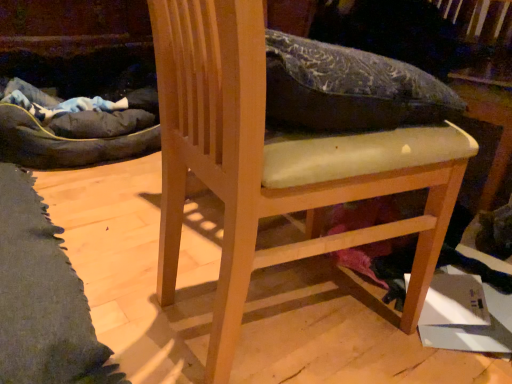
Locate an element on the screen. This screenshot has width=512, height=384. light wood chair at center is located at coordinates (276, 165).

Image resolution: width=512 pixels, height=384 pixels. Describe the element at coordinates (276, 165) in the screenshot. I see `light wood chair at center` at that location.

The height and width of the screenshot is (384, 512). What do you see at coordinates (467, 317) in the screenshot?
I see `white cardboard box at lower right` at bounding box center [467, 317].

Find the location of a particular element. The width and height of the screenshot is (512, 384). white cardboard box at lower right is located at coordinates coord(467,317).

In order to face white cardboard box at lower right, should I rotate leftwards or rightwards?

You should look right and rotate roughly 26.870 degrees.

Image resolution: width=512 pixels, height=384 pixels. In order to click on light wood chair at center in this screenshot , I will do `click(276, 165)`.

Is white cardboard box at lower right to the left of light wood chair at center from the viewer's perspective?

No.

Between white cardboard box at lower right and light wood chair at center, which one is positioned behind?

white cardboard box at lower right.

Does point (445, 304) come closer to viewer compared to point (441, 160)?

No.

From the image's perspective, which one is positioned higher, white cardboard box at lower right or light wood chair at center?

light wood chair at center appears higher in the image.

From a real-world perspective, which is physically below, white cardboard box at lower right or light wood chair at center?

From a 3D spatial view, white cardboard box at lower right is below.

Is white cardboard box at lower right wider than light wood chair at center?

No.

Which of these two, white cardboard box at lower right or light wood chair at center, stands shorter?

With less height is white cardboard box at lower right.

Looking at this image, considering the sizes of objects white cardboard box at lower right and light wood chair at center in the image provided, who is bigger, white cardboard box at lower right or light wood chair at center?

light wood chair at center is bigger.

Is white cardboard box at lower right completely or partially outside of light wood chair at center?

Absolutely, white cardboard box at lower right is external to light wood chair at center.

Is white cardboard box at lower right not close to light wood chair at center?

white cardboard box at lower right is near light wood chair at center, not far away.

Is light wood chair at center at the back of white cardboard box at lower right?

No, white cardboard box at lower right's orientation is not away from light wood chair at center.

Can you tell me how much white cardboard box at lower right and light wood chair at center differ in facing direction?

135 degrees.

Identify the location of furniture above the white cardboard box at lower right (from the image's perspective). (276, 165).

Which object is positioned more to the right, light wood chair at center or white cardboard box at lower right?

white cardboard box at lower right is more to the right.

Relative to white cardboard box at lower right, is light wood chair at center in front or behind?

light wood chair at center is in front of white cardboard box at lower right.

Is point (243, 102) positioned after point (494, 349)?

That is False.

From the picture: From the image's perspective, which one is positioned higher, light wood chair at center or white cardboard box at lower right?

From the image's view, light wood chair at center is above.

From a real-world perspective, does light wood chair at center stand above white cardboard box at lower right?

Yes, from a real-world perspective, light wood chair at center is above white cardboard box at lower right.

Which object is wider, light wood chair at center or white cardboard box at lower right?

Wider between the two is light wood chair at center.

Is light wood chair at center taller or shorter than white cardboard box at lower right?

Considering their sizes, light wood chair at center has more height than white cardboard box at lower right.

Which of these two, light wood chair at center or white cardboard box at lower right, is smaller?

white cardboard box at lower right is smaller.

Would you say white cardboard box at lower right is part of light wood chair at center's contents?

No, white cardboard box at lower right is not a part of light wood chair at center.

Would you say light wood chair at center is a long distance from white cardboard box at lower right?

light wood chair at center is near white cardboard box at lower right, not far away.

Could you tell me if light wood chair at center is facing white cardboard box at lower right?

Yes, light wood chair at center faces towards white cardboard box at lower right.

Can you tell me how much light wood chair at center and white cardboard box at lower right differ in facing direction?

There is a 135-degree angle between the facing directions of light wood chair at center and white cardboard box at lower right.

Measure the distance from light wood chair at center to white cardboard box at lower right.

light wood chair at center and white cardboard box at lower right are 15.96 inches apart from each other.

Locate an element on the screen. The image size is (512, 384). furniture above the white cardboard box at lower right (from a real-world perspective) is located at coordinates (276, 165).

There is a white cardboard box at lower right. Where is `furniture above it (from a real-world perspective)`? The image size is (512, 384). furniture above it (from a real-world perspective) is located at coordinates (276, 165).

Image resolution: width=512 pixels, height=384 pixels. I want to click on cardboard box lying below the light wood chair at center (from the image's perspective), so click(467, 317).